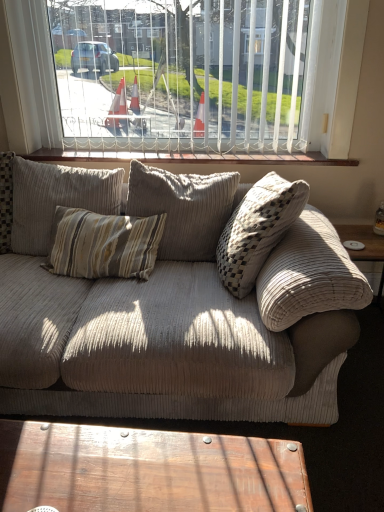
Question: In which direction should I rotate to look at beige corduroy pillow at center, which ranks as the first pillow in left-to-right order?

Choices:
 (A) left
 (B) right

Answer: (A)

Question: Is beige corduroy pillow at center, marked as the 2th pillow in a right-to-left arrangement, at the left side of beige corduroy couch at center?

Choices:
 (A) no
 (B) yes

Answer: (B)

Question: Considering the relative sizes of beige corduroy pillow at center, marked as the 2th pillow in a right-to-left arrangement, and beige corduroy couch at center in the image provided, is beige corduroy pillow at center, marked as the 2th pillow in a right-to-left arrangement, taller than beige corduroy couch at center?

Choices:
 (A) yes
 (B) no

Answer: (B)

Question: Does beige corduroy pillow at center, which ranks as the first pillow in left-to-right order, have a lesser height compared to beige corduroy couch at center?

Choices:
 (A) yes
 (B) no

Answer: (A)

Question: Is beige corduroy pillow at center, marked as the 2th pillow in a right-to-left arrangement, located outside beige corduroy couch at center?

Choices:
 (A) yes
 (B) no

Answer: (B)

Question: Can you see beige corduroy pillow at center, marked as the 2th pillow in a right-to-left arrangement, touching beige corduroy couch at center?

Choices:
 (A) yes
 (B) no

Answer: (B)

Question: Considering the relative sizes of beige corduroy pillow at center, which ranks as the first pillow in left-to-right order, and beige corduroy couch at center in the image provided, is beige corduroy pillow at center, which ranks as the first pillow in left-to-right order, thinner than beige corduroy couch at center?

Choices:
 (A) yes
 (B) no

Answer: (A)

Question: Is beige corduroy couch at center facing towards wooden polished coffee table at lower center?

Choices:
 (A) yes
 (B) no

Answer: (A)

Question: Is beige corduroy couch at center at the right side of wooden polished coffee table at lower center?

Choices:
 (A) yes
 (B) no

Answer: (B)

Question: Is the surface of beige corduroy couch at center in direct contact with wooden polished coffee table at lower center?

Choices:
 (A) no
 (B) yes

Answer: (A)

Question: Considering the relative sizes of beige corduroy couch at center and wooden polished coffee table at lower center in the image provided, is beige corduroy couch at center wider than wooden polished coffee table at lower center?

Choices:
 (A) yes
 (B) no

Answer: (A)

Question: Does beige corduroy couch at center have a lesser width compared to wooden polished coffee table at lower center?

Choices:
 (A) yes
 (B) no

Answer: (B)

Question: From a real-world perspective, does beige corduroy couch at center sit lower than wooden polished coffee table at lower center?

Choices:
 (A) no
 (B) yes

Answer: (A)

Question: Is wooden polished coffee table at lower center wider than corduroy pillow at center, marked as the 2th pillow in a left-to-right arrangement?

Choices:
 (A) no
 (B) yes

Answer: (A)